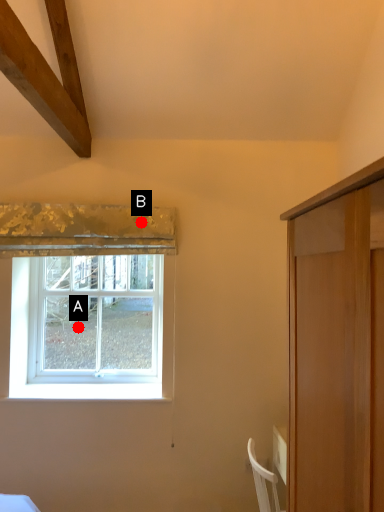
Question: Two points are circled on the image, labeled by A and B beside each circle. Which of the following is the closest to the observer?

Choices:
 (A) A is closer
 (B) B is closer

Answer: (B)